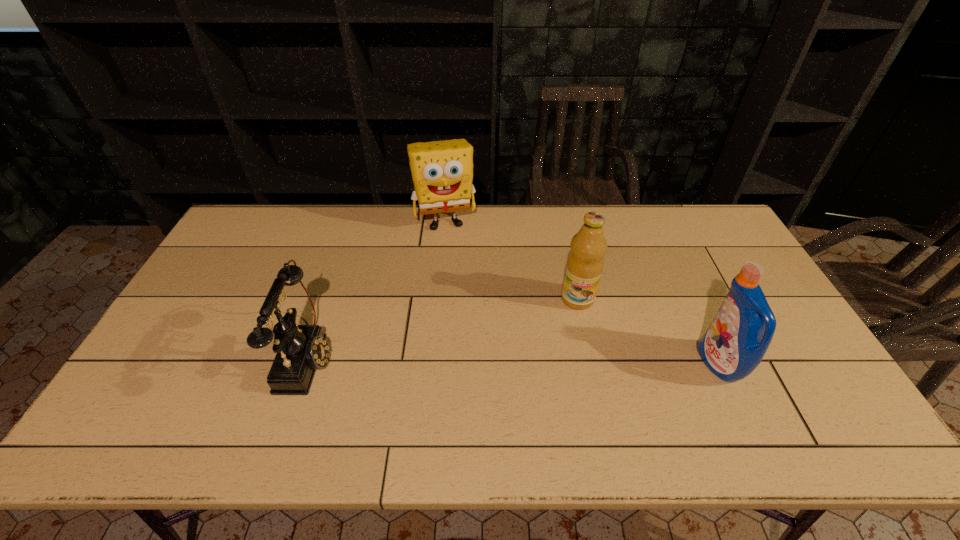
Image resolution: width=960 pixels, height=540 pixels. What are the coordinates of `free space between the third nearest object and the farthest object` in the screenshot? It's located at (511, 260).

At what (x,y) coordinates should I click in order to perform the action: click on free space between the third object from left to right and the sponge. Please return your answer as a coordinate pair (x, y). Image resolution: width=960 pixels, height=540 pixels. Looking at the image, I should click on (511, 260).

Find the location of a particular element. free point between the second farthest object and the detergent is located at coordinates (648, 331).

The height and width of the screenshot is (540, 960). In order to click on vacant area between the telephone and the third object from left to right in this screenshot , I will do `click(443, 327)`.

Find the location of a particular element. free spot between the shortest object and the sponge is located at coordinates (376, 289).

This screenshot has width=960, height=540. What are the coordinates of `the second closest object to the second object from right to left` in the screenshot? It's located at (442, 171).

Identify which object is located as the second nearest to the detergent. Please provide its 2D coordinates. Your answer should be formatted as a tuple, i.e. [(x, y)], where the tuple contains the x and y coordinates of a point satisfying the conditions above.

[(442, 171)]

Where is `free space that satisfies the following two spatial constraints: 1. on the front side of the third nearest object; 2. on the left side of the second object from left to right`? Image resolution: width=960 pixels, height=540 pixels. free space that satisfies the following two spatial constraints: 1. on the front side of the third nearest object; 2. on the left side of the second object from left to right is located at coordinates (438, 299).

Where is `free point that satisfies the following two spatial constraints: 1. on the front side of the sponge; 2. on the label of the rightmost object`? free point that satisfies the following two spatial constraints: 1. on the front side of the sponge; 2. on the label of the rightmost object is located at coordinates (431, 364).